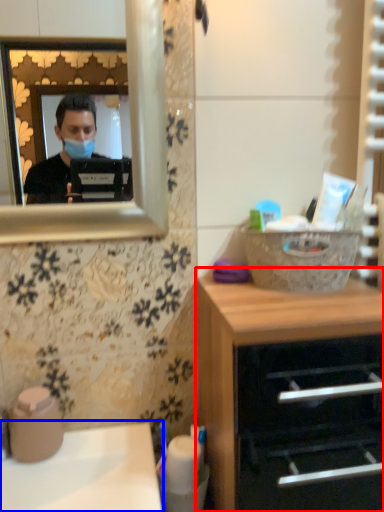
Question: Which object is closer to the camera taking this photo, chest of drawers (highlighted by a red box) or sink (highlighted by a blue box)?

Choices:
 (A) chest of drawers
 (B) sink

Answer: (A)